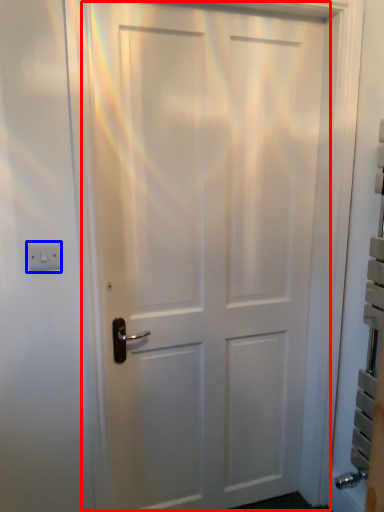
Question: Which of the following is the farthest to the observer, door (highlighted by a red box) or light switch (highlighted by a blue box)?

Choices:
 (A) door
 (B) light switch

Answer: (B)